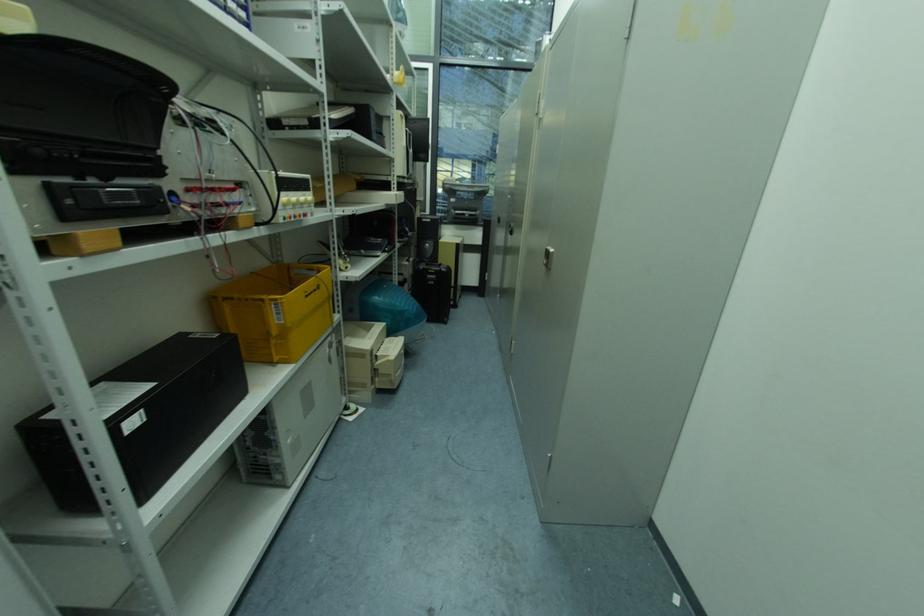
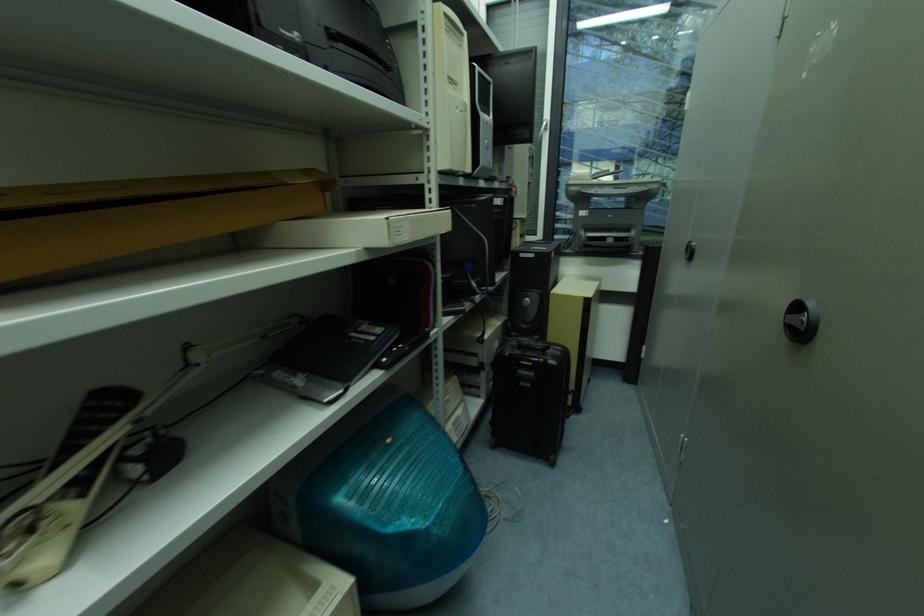
Question: Which direction would the cameraman need to move to produce the second image? Reply with the corresponding letter.

Choices:
 (A) Left
 (B) Right
 (C) Forward
 (D) Backward

Answer: (C)